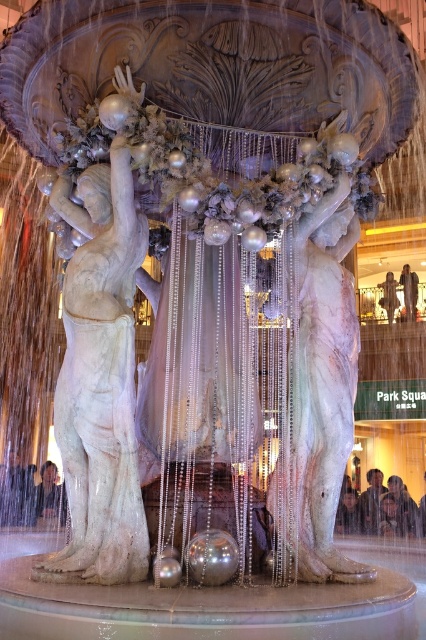
You are standing at the center of the fountain area and want to find the white marble statue at left. According to the coordinates provided, where should you look relative to your position?

The white marble statue at left is located at coordinates 0.572 on the x axis and 0.237 on the y axis relative to your position at the center of the fountain area.

You are planning to place a new bench in the park so visitors can enjoy the view of both the white marble statue at left and the white marble statue at center. Since you want the bench to be at a distance where both statues are visible, which statue will appear larger from the bench?

The white marble statue at left will appear larger because it is much taller than the white marble statue at center.

You are an architect designing a new public space and are inspired by the statues in the fountain. You want to place a small bench between the white marble statue at left and the white marble statue at center. Considering their thickness, which statue should the bench be closer to?

The bench should be placed closer to the white marble statue at left because it is thinner than the white marble statue at center, allowing for more space around the thicker statue.